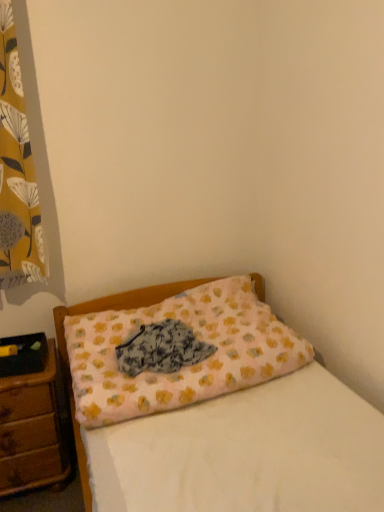
Question: Looking at the image, does yellow floral fabric at left seem bigger or smaller compared to brown wooden nightstand at lower left?

Choices:
 (A) small
 (B) big

Answer: (A)

Question: Considering their positions, is yellow floral fabric at left located in front of or behind brown wooden nightstand at lower left?

Choices:
 (A) front
 (B) behind

Answer: (A)

Question: Which is farther from the pink fabric pillow at center?

Choices:
 (A) fluffy fabric at center
 (B) yellow floral fabric at left
 (C) brown wooden nightstand at lower left

Answer: (B)

Question: Which is farther from the fluffy fabric at center?

Choices:
 (A) brown wooden nightstand at lower left
 (B) pink fabric pillow at center
 (C) yellow floral fabric at left

Answer: (C)